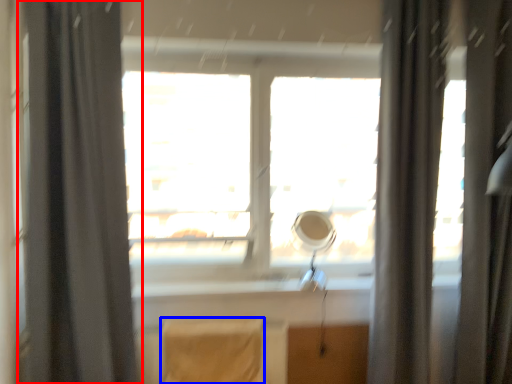
Question: Which object is closer to the camera taking this photo, curtain (highlighted by a red box) or chair (highlighted by a blue box)?

Choices:
 (A) curtain
 (B) chair

Answer: (A)